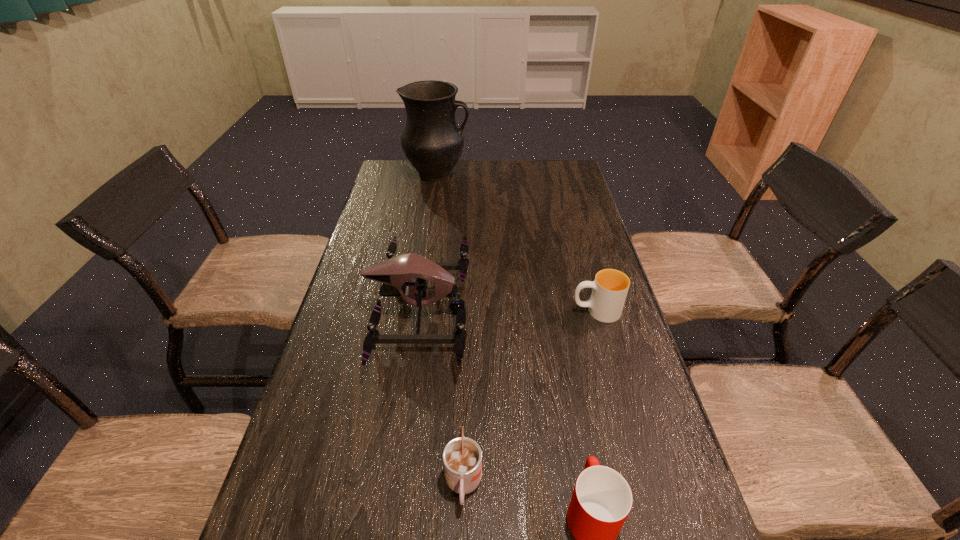
What are the coordinates of `object that is at the far edge` in the screenshot? It's located at (432, 141).

The width and height of the screenshot is (960, 540). In order to click on pitcher present at the left edge in this screenshot , I will do `click(432, 141)`.

At what (x,y) coordinates should I click in order to perform the action: click on drone at the left edge. Please return your answer as a coordinate pair (x, y). Looking at the image, I should click on (395, 274).

Where is `object that is at the right edge`? The width and height of the screenshot is (960, 540). object that is at the right edge is located at coordinates (610, 287).

The image size is (960, 540). I want to click on object at the far left corner, so click(x=432, y=141).

Image resolution: width=960 pixels, height=540 pixels. What are the coordinates of `vacant space at the far edge of the desktop` in the screenshot? It's located at (533, 168).

Locate an element on the screen. vacant space at the left edge of the desktop is located at coordinates (329, 433).

I want to click on free space at the right edge of the desktop, so click(630, 349).

Identify the location of blank region between the farthest object and the second tallest object. (428, 242).

Locate an element on the screen. This screenshot has width=960, height=540. vacant space that is in between the leftmost cup and the farthest object is located at coordinates (450, 329).